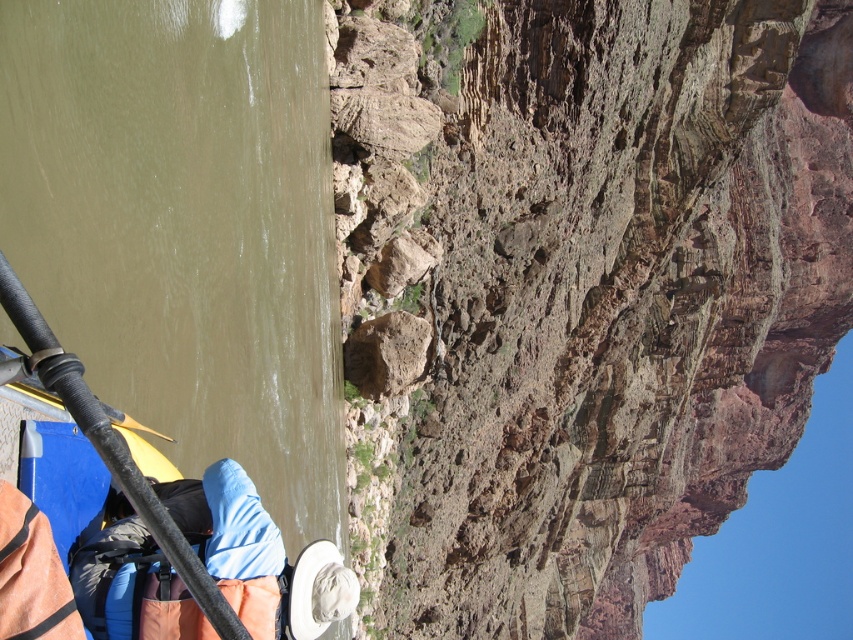
Question: Does brown rough cliff at upper right have a lesser width compared to greenish-brown water at left?

Choices:
 (A) yes
 (B) no

Answer: (B)

Question: Among these points, which one is nearest to the camera?

Choices:
 (A) (711, 32)
 (B) (97, 86)

Answer: (B)

Question: Is brown rough cliff at upper right wider than greenish-brown water at left?

Choices:
 (A) yes
 (B) no

Answer: (A)

Question: Does brown rough cliff at upper right have a lesser width compared to greenish-brown water at left?

Choices:
 (A) yes
 (B) no

Answer: (B)